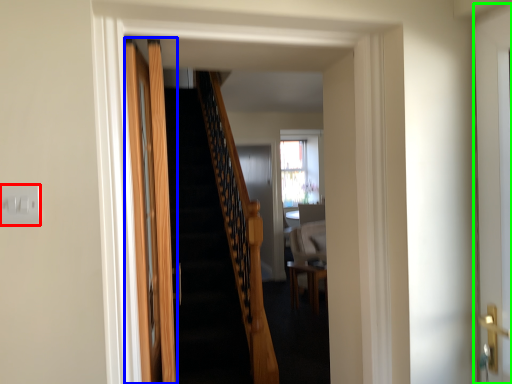
Question: Based on their relative distances, which object is nearer to electric outlet (highlighted by a red box)? Choose from door (highlighted by a blue box) and door (highlighted by a green box).

Choices:
 (A) door
 (B) door

Answer: (A)